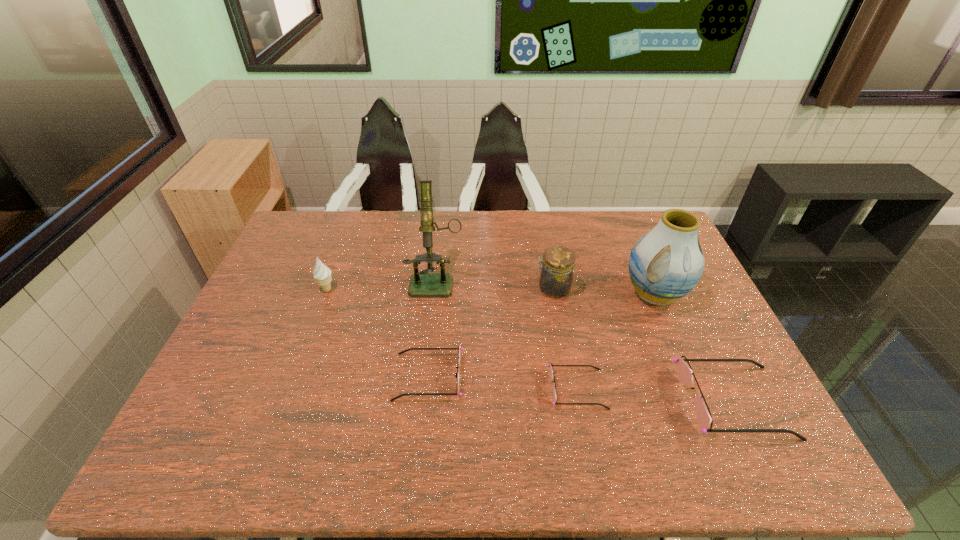
Where is `the sixth tallest object`? The height and width of the screenshot is (540, 960). the sixth tallest object is located at coordinates [459, 349].

Find the location of `the second shortest sunglasses`. the second shortest sunglasses is located at coordinates (459, 349).

At what (x,y) coordinates should I click in order to perform the action: click on the second sunglasses from left to right. Please return your answer as a coordinate pair (x, y). Image resolution: width=960 pixels, height=540 pixels. Looking at the image, I should click on (554, 403).

At what (x,y) coordinates should I click in order to perform the action: click on the shortest object. Please return your answer as a coordinate pair (x, y). The height and width of the screenshot is (540, 960). Looking at the image, I should click on (554, 403).

What are the coordinates of `the rightmost sunglasses` in the screenshot? It's located at (685, 374).

Image resolution: width=960 pixels, height=540 pixels. What are the coordinates of `the tallest sunglasses` in the screenshot? It's located at [685, 374].

The height and width of the screenshot is (540, 960). Find the location of `microscope`. microscope is located at coordinates (422, 284).

Image resolution: width=960 pixels, height=540 pixels. Identify the location of vase. (666, 263).

Where is `the leftmost object`? the leftmost object is located at coordinates pos(322,274).

What are the coordinates of `jar` in the screenshot? It's located at (556, 276).